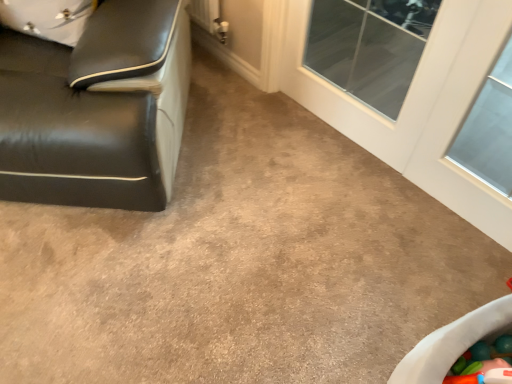
Question: From their relative heights in the image, would you say transparent glass door at upper right is taller or shorter than black leather couch at left?

Choices:
 (A) tall
 (B) short

Answer: (B)

Question: Is point click(473, 188) closer or farther from the camera than point click(1, 188)?

Choices:
 (A) farther
 (B) closer

Answer: (A)

Question: Is transparent glass door at upper right to the left or to the right of black leather couch at left in the image?

Choices:
 (A) right
 (B) left

Answer: (A)

Question: Would you say black leather couch at left is to the left or to the right of transparent glass door at upper right in the picture?

Choices:
 (A) left
 (B) right

Answer: (A)

Question: Is black leather couch at left wider or thinner than transparent glass door at upper right?

Choices:
 (A) thin
 (B) wide

Answer: (B)

Question: Considering their positions, is black leather couch at left located in front of or behind transparent glass door at upper right?

Choices:
 (A) front
 (B) behind

Answer: (A)

Question: Choose the correct answer: Is black leather couch at left inside transparent glass door at upper right or outside it?

Choices:
 (A) inside
 (B) outside

Answer: (B)